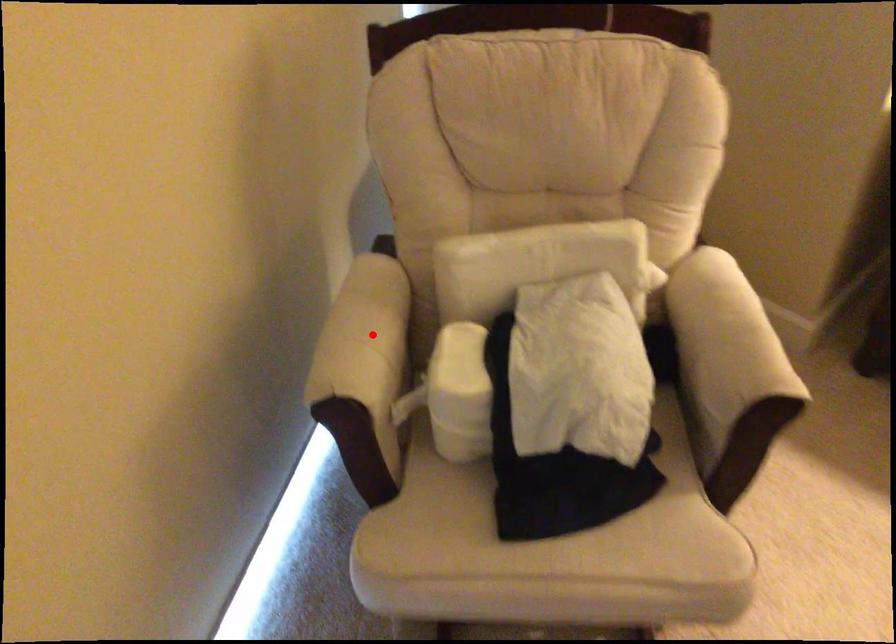
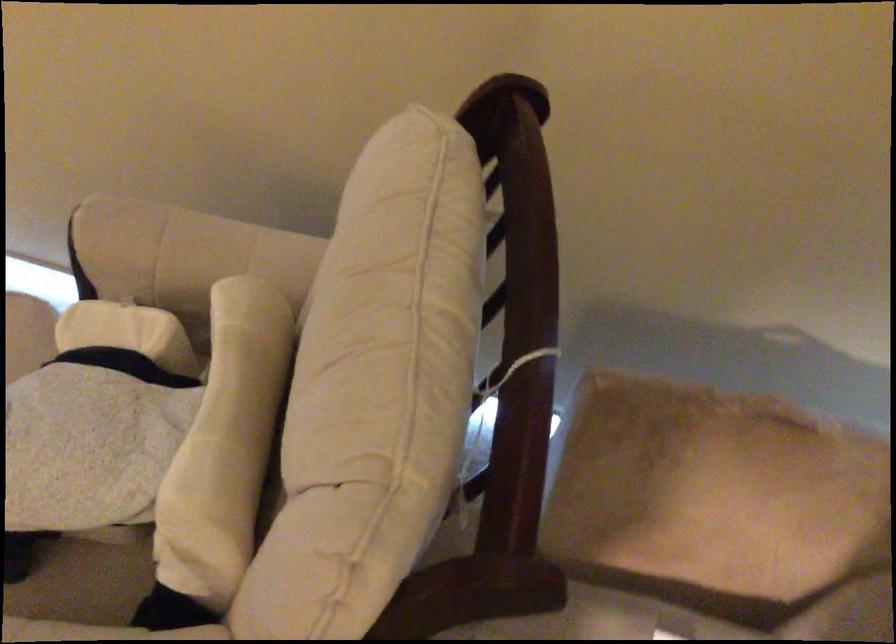
Question: A red point is marked in image1. In image2, is the corresponding 3D point closer to the camera or farther? Reply with the corresponding letter.

Choices:
 (A) The corresponding 3D point is closer.
 (B) The corresponding 3D point is farther.

Answer: (A)